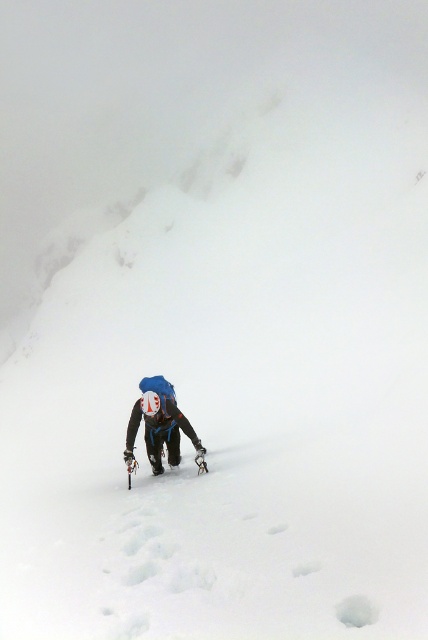
You are a mountaineer planning to attach a safety rope to either the blue fabric backpack at center or the metallic silver ski at center. Which object should you choose if you need the one with more vertical space?

The blue fabric backpack at center has a greater height compared to the metallic silver ski at center, so you should choose the blue fabric backpack at center for attaching the safety rope as it provides more vertical space.

You are a mountaineer planning to place a safety anchor. The blue fabric backpack at center is located at coordinates 0.664, 0.374. If you want to place the anchor 0.1 units to the right and 0.05 units below the backpack, what are the new coordinates?

The new coordinates would be 0.664 plus 0.1 equals 0.764 for the x coordinate, and 0.374 minus 0.05 equals 0.324 for the y coordinate. So the new coordinates are (138,488).

You are navigating a steep snowy slope and need to place two markers at the coordinates provided. According to the image, which point, point (186, 417) or point (199, 464), is positioned further back from your current viewpoint?

Point (186, 417) is behind point (199, 464), so it is positioned further back from your current viewpoint.